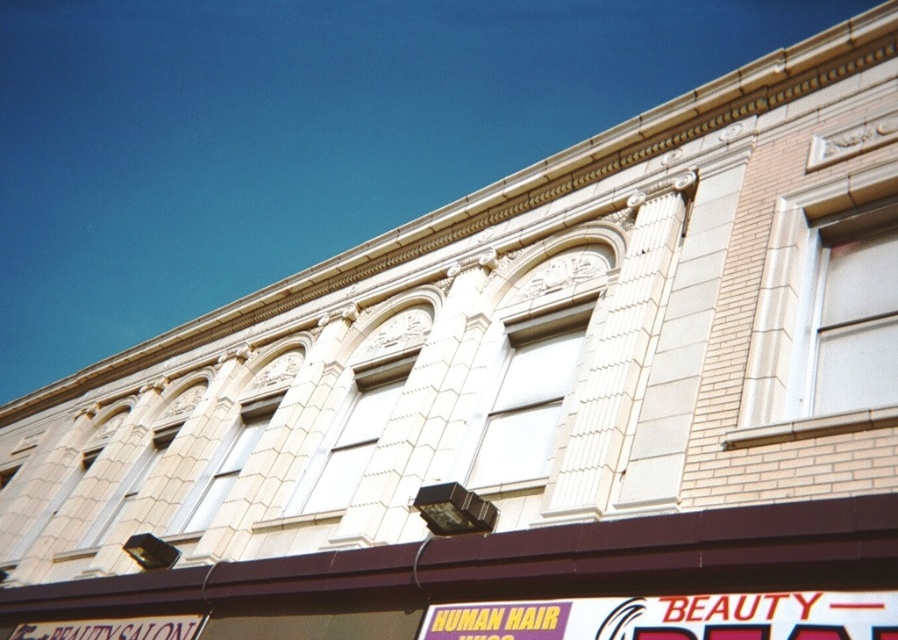
This screenshot has width=898, height=640. What do you see at coordinates (522, 561) in the screenshot?
I see `brown matte awning at center` at bounding box center [522, 561].

Is brown matte awning at center below yellow matte sign at lower center?

Yes.

Find the location of `brown matte awning at center`. brown matte awning at center is located at coordinates (522, 561).

You are a GUI agent. You are given a task and a screenshot of the screen. Output one action in this format:
    pyautogui.click(x=<x>, y=<y>)
    Task: Click on the brown matte awning at center
    This screenshot has width=898, height=640.
    Given the screenshot: What is the action you would take?
    pyautogui.click(x=522, y=561)